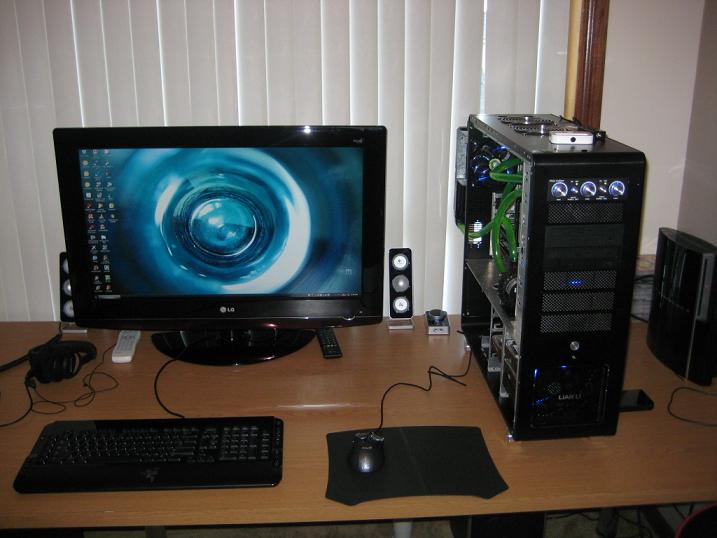
The height and width of the screenshot is (538, 717). What are the coordinates of `mouse` in the screenshot? It's located at (376, 451).